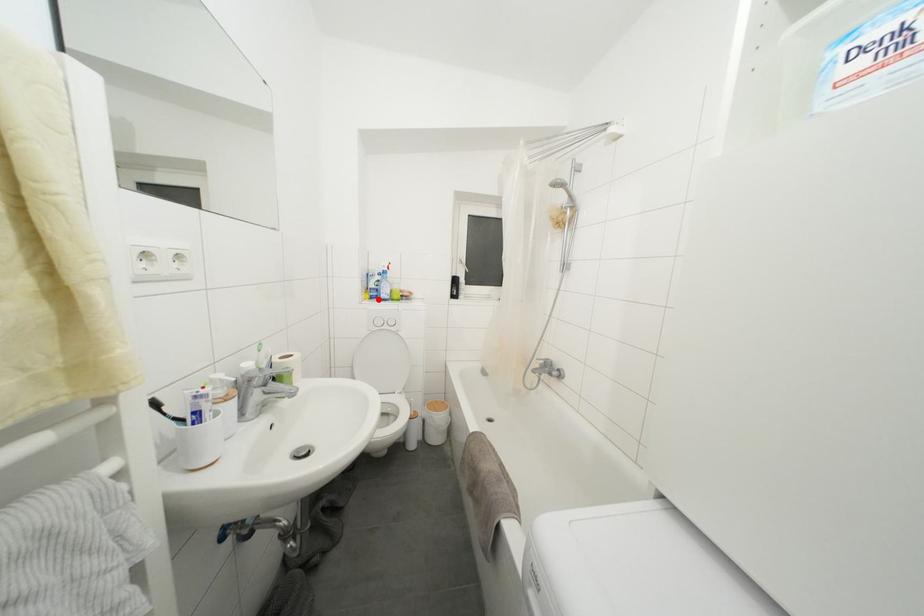
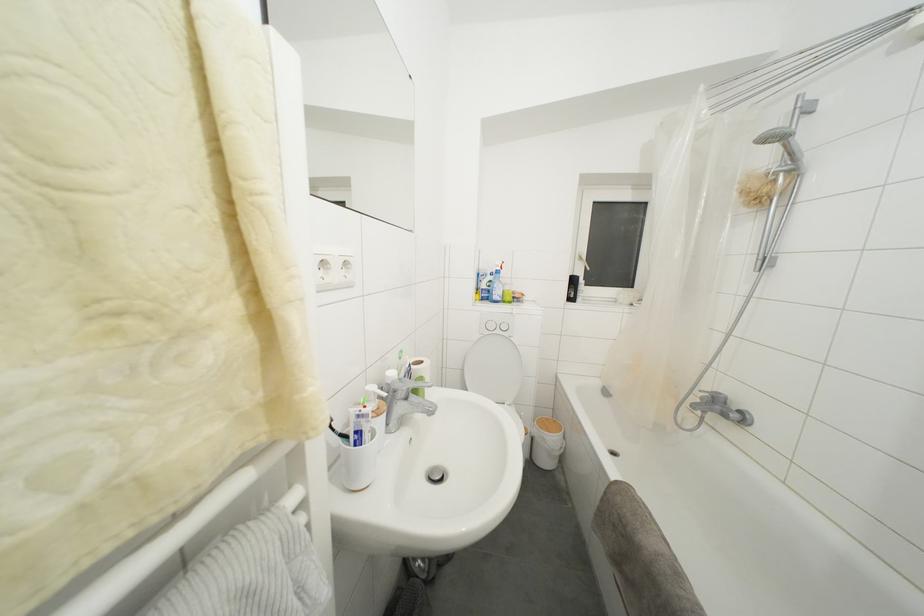
Where in the second image is the point corresponding to the highlighted location from the first image?

(490, 301)